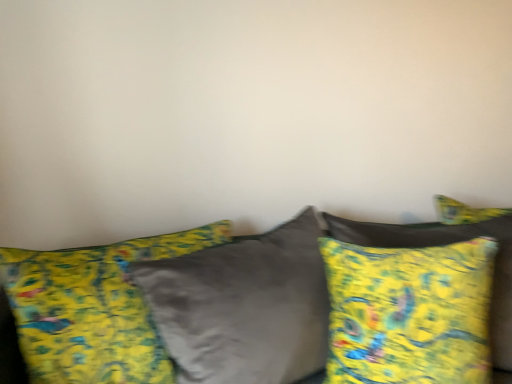
The image size is (512, 384). What do you see at coordinates (292, 294) in the screenshot?
I see `velvet yellow pillows at center` at bounding box center [292, 294].

Based on the photo, measure the distance between yellow fabric pillow at right, the second pillow from the left, and camera.

The depth of yellow fabric pillow at right, the second pillow from the left, is 3.77 feet.

Describe the element at coordinates (93, 309) in the screenshot. I see `yellow fabric pillow at center, acting as the second pillow starting from the right` at that location.

What is the approximate height of yellow fabric pillow at center, acting as the second pillow starting from the right?

It is 28.57 inches.

At what (x,y) coordinates should I click in order to perform the action: click on velvet yellow pillows at center. Please return your answer as a coordinate pair (x, y). The width and height of the screenshot is (512, 384). Looking at the image, I should click on (292, 294).

Could you tell me if yellow fabric pillow at right, the first pillow positioned from the right, is turned towards velvet yellow pillows at center?

Yes, yellow fabric pillow at right, the first pillow positioned from the right, is facing velvet yellow pillows at center.

Can you confirm if yellow fabric pillow at right, the second pillow from the left, is positioned to the left of velvet yellow pillows at center?

Incorrect, yellow fabric pillow at right, the second pillow from the left, is not on the left side of velvet yellow pillows at center.

From the picture: Is yellow fabric pillow at right, the first pillow positioned from the right, taller than velvet yellow pillows at center?

No.

Considering the sizes of objects yellow fabric pillow at right, the second pillow from the left, and velvet yellow pillows at center in the image provided, who is thinner, yellow fabric pillow at right, the second pillow from the left, or velvet yellow pillows at center?

Thinner between the two is yellow fabric pillow at right, the second pillow from the left.

How far apart are velvet yellow pillows at center and yellow fabric pillow at right, the first pillow positioned from the right?

6.67 inches.

Considering the positions of point (197, 362) and point (392, 242), is point (197, 362) closer or farther from the camera than point (392, 242)?

Point (197, 362) is closer to the camera than point (392, 242).

In the image, is velvet yellow pillows at center positioned in front of or behind yellow fabric pillow at right, the first pillow positioned from the right?

Clearly, velvet yellow pillows at center is in front of yellow fabric pillow at right, the first pillow positioned from the right.

Is velvet yellow pillows at center bigger or smaller than yellow fabric pillow at right, the first pillow positioned from the right?

In the image, velvet yellow pillows at center appears to be larger than yellow fabric pillow at right, the first pillow positioned from the right.

Does point (134, 270) come closer to viewer compared to point (88, 311)?

That is False.

From the image's perspective, would you say velvet yellow pillows at center is positioned over yellow fabric pillow at center, the 1th pillow in the left-to-right sequence?

Actually, velvet yellow pillows at center appears below yellow fabric pillow at center, the 1th pillow in the left-to-right sequence, in the image.

Considering the relative sizes of velvet yellow pillows at center and yellow fabric pillow at center, the 1th pillow in the left-to-right sequence, in the image provided, is velvet yellow pillows at center shorter than yellow fabric pillow at center, the 1th pillow in the left-to-right sequence,?

Yes, velvet yellow pillows at center is shorter than yellow fabric pillow at center, the 1th pillow in the left-to-right sequence.

Is velvet yellow pillows at center spatially inside yellow fabric pillow at center, acting as the second pillow starting from the right, or outside of it?

The correct answer is: outside.

Are yellow fabric pillow at center, acting as the second pillow starting from the right, and yellow fabric pillow at right, the second pillow from the left, beside each other?

No, yellow fabric pillow at center, acting as the second pillow starting from the right, is not touching yellow fabric pillow at right, the second pillow from the left.

From their relative heights in the image, would you say yellow fabric pillow at center, acting as the second pillow starting from the right, is taller or shorter than yellow fabric pillow at right, the second pillow from the left?

In the image, yellow fabric pillow at center, acting as the second pillow starting from the right, appears to be taller than yellow fabric pillow at right, the second pillow from the left.

From the picture: Based on their sizes in the image, would you say yellow fabric pillow at center, acting as the second pillow starting from the right, is bigger or smaller than yellow fabric pillow at right, the first pillow positioned from the right?

In the image, yellow fabric pillow at center, acting as the second pillow starting from the right, appears to be larger than yellow fabric pillow at right, the first pillow positioned from the right.

Which object is closer to the camera, yellow fabric pillow at right, the second pillow from the left, or yellow fabric pillow at center, acting as the second pillow starting from the right?

Positioned in front is yellow fabric pillow at center, acting as the second pillow starting from the right.

Measure the distance between yellow fabric pillow at right, the first pillow positioned from the right, and yellow fabric pillow at center, the 1th pillow in the left-to-right sequence.

70.95 centimeters.

Which is more to the right, yellow fabric pillow at right, the first pillow positioned from the right, or yellow fabric pillow at center, the 1th pillow in the left-to-right sequence?

yellow fabric pillow at right, the first pillow positioned from the right, is more to the right.

Which object is positioned more to the right, yellow fabric pillow at center, the 1th pillow in the left-to-right sequence, or velvet yellow pillows at center?

Positioned to the right is velvet yellow pillows at center.

Which is correct: yellow fabric pillow at center, the 1th pillow in the left-to-right sequence, is inside velvet yellow pillows at center, or outside of it?

The correct answer is: inside.

Considering the sizes of objects yellow fabric pillow at center, the 1th pillow in the left-to-right sequence, and velvet yellow pillows at center in the image provided, who is shorter, yellow fabric pillow at center, the 1th pillow in the left-to-right sequence, or velvet yellow pillows at center?

With less height is velvet yellow pillows at center.

From the picture: Which object is thinner, yellow fabric pillow at center, acting as the second pillow starting from the right, or velvet yellow pillows at center?

Thinner between the two is yellow fabric pillow at center, acting as the second pillow starting from the right.

Where is `pillow that is the 2nd object located above the velvet yellow pillows at center (from the image's perspective)`? This screenshot has height=384, width=512. pillow that is the 2nd object located above the velvet yellow pillows at center (from the image's perspective) is located at coordinates (447, 244).

Image resolution: width=512 pixels, height=384 pixels. I want to click on studio couch lying below the yellow fabric pillow at right, the second pillow from the left (from the image's perspective), so 292,294.

Which object lies nearer to the anchor point yellow fabric pillow at center, acting as the second pillow starting from the right, yellow fabric pillow at right, the second pillow from the left, or velvet yellow pillows at center?

Among the two, velvet yellow pillows at center is located nearer to yellow fabric pillow at center, acting as the second pillow starting from the right.

Looking at the image, which one is located closer to yellow fabric pillow at center, acting as the second pillow starting from the right, velvet yellow pillows at center or yellow fabric pillow at right, the second pillow from the left?

velvet yellow pillows at center is positioned closer to the anchor yellow fabric pillow at center, acting as the second pillow starting from the right.

Looking at this image, which object lies nearer to the anchor point yellow fabric pillow at right, the second pillow from the left, velvet yellow pillows at center or yellow fabric pillow at center, the 1th pillow in the left-to-right sequence?

velvet yellow pillows at center is closer to yellow fabric pillow at right, the second pillow from the left.

Considering their positions, is yellow fabric pillow at center, acting as the second pillow starting from the right, positioned closer to velvet yellow pillows at center than yellow fabric pillow at right, the second pillow from the left?

The object closer to velvet yellow pillows at center is yellow fabric pillow at right, the second pillow from the left.

From the image, which object appears to be nearer to yellow fabric pillow at right, the second pillow from the left, yellow fabric pillow at center, the 1th pillow in the left-to-right sequence, or velvet yellow pillows at center?

Based on the image, velvet yellow pillows at center appears to be nearer to yellow fabric pillow at right, the second pillow from the left.

Which object lies nearer to the anchor point velvet yellow pillows at center, yellow fabric pillow at right, the first pillow positioned from the right, or yellow fabric pillow at center, acting as the second pillow starting from the right?

yellow fabric pillow at right, the first pillow positioned from the right, is positioned closer to the anchor velvet yellow pillows at center.

Locate an element on the screen. Image resolution: width=512 pixels, height=384 pixels. studio couch between yellow fabric pillow at center, the 1th pillow in the left-to-right sequence, and yellow fabric pillow at right, the second pillow from the left, from left to right is located at coordinates (292, 294).